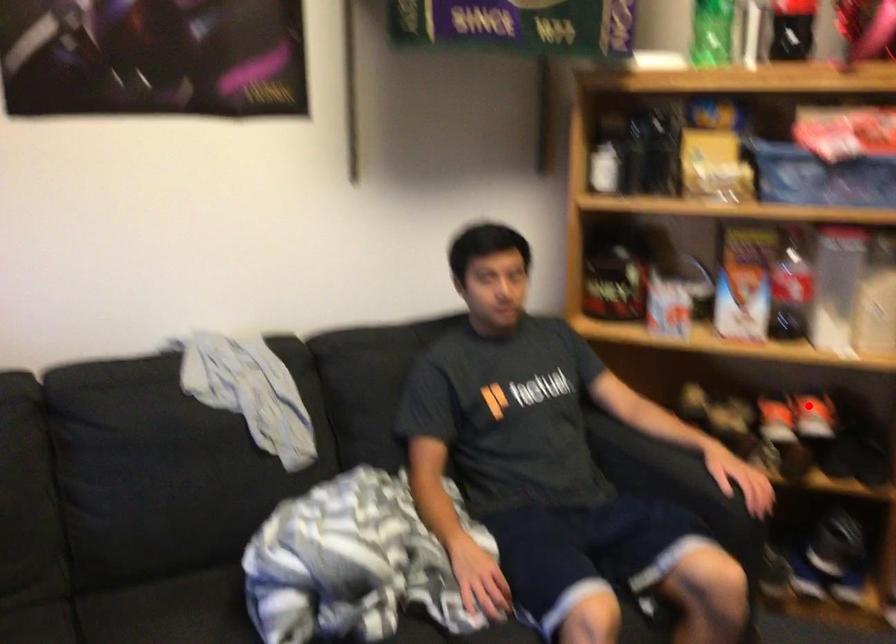
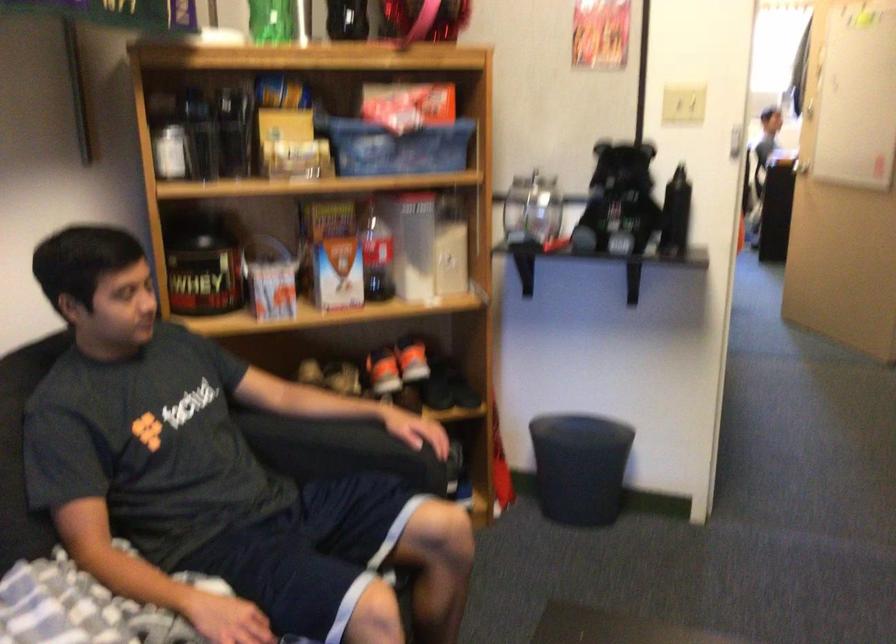
Question: I am providing you with two images of the same scene from different viewpoints. Given a red point in image1, look at the same physical point in image2. Is it:

Choices:
 (A) Closer to the viewpoint
 (B) Farther from the viewpoint

Answer: (B)